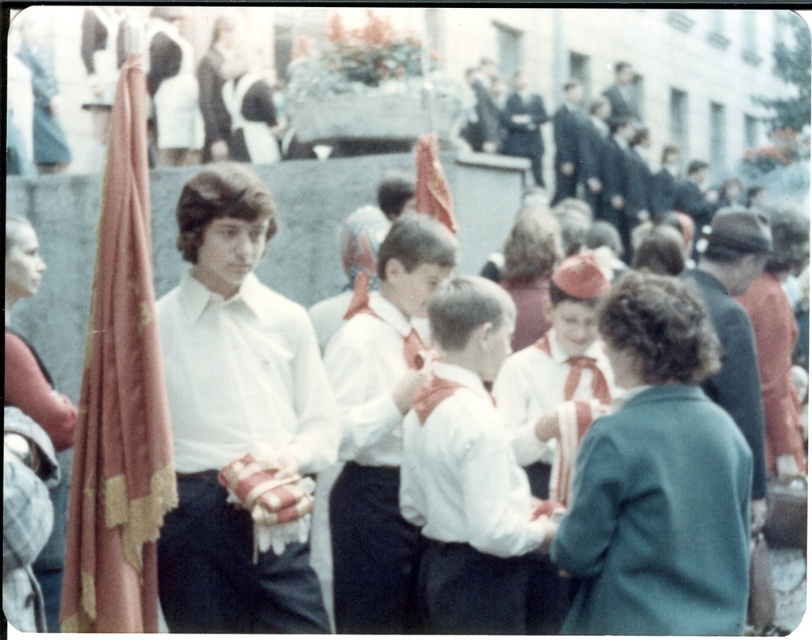
You are standing in the crowd at this formal event and notice two people wearing white shirts. One is wearing a white cotton shirt at center and the other a matte white shirt at upper center. Which of these two shirts is positioned to the left when viewed from your perspective?

The white cotton shirt at center is positioned to the left of the matte white shirt at upper center.

You are attending this event and need to take a photo of the white matte shirt at center and the green wool coat at center. Which of the two items would appear narrower in the photo?

The white matte shirt at center appears narrower in the photo because it has a lesser width compared to the green wool coat at center.

You are standing at the ceremony and want to know which of the two points, point [387,492] or point [625,96], is nearer to you. Can you determine this based on their positions?

Point [387,492] is closer to the viewer than point [625,96].